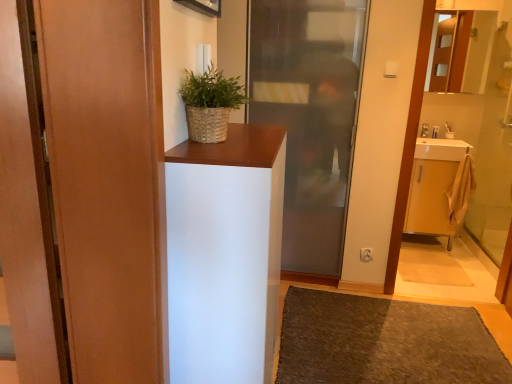
Describe the element at coordinates (225, 255) in the screenshot. I see `white matte cabinet at center` at that location.

What are the coordinates of `transparent glass door at center, the first door in the right-to-left sequence` in the screenshot? It's located at (309, 115).

What do you see at coordinates (309, 115) in the screenshot? I see `transparent glass door at center, placed as the 2th door when sorted from left to right` at bounding box center [309, 115].

The image size is (512, 384). I want to click on brown textured rug at lower center, so click(x=384, y=342).

Image resolution: width=512 pixels, height=384 pixels. What do you see at coordinates (108, 182) in the screenshot? I see `matte wood door at left, the 1th door from the front` at bounding box center [108, 182].

The width and height of the screenshot is (512, 384). I want to click on white matte cabinet at center, so click(225, 255).

Which point is more forward, (354, 362) or (425, 135)?

Point (354, 362)

Who is taller, brown textured rug at lower center or white plastic toothbrush at upper right?

With more height is white plastic toothbrush at upper right.

Is brown textured rug at lower center facing away from white plastic toothbrush at upper right?

No, brown textured rug at lower center's orientation is not away from white plastic toothbrush at upper right.

Which object is positioned more to the left, woven brown basket at upper center or matte wood door at left, the 1th door from the front?

From the viewer's perspective, matte wood door at left, the 1th door from the front, appears more on the left side.

Looking at this image, is woven brown basket at upper center oriented towards matte wood door at left, marked as the first door in a left-to-right arrangement?

No, woven brown basket at upper center is not facing towards matte wood door at left, marked as the first door in a left-to-right arrangement.

From the image's perspective, relative to matte wood door at left, arranged as the 2th door when viewed from the back, is woven brown basket at upper center above or below?

Clearly, from the image's perspective, woven brown basket at upper center is above matte wood door at left, arranged as the 2th door when viewed from the back.

Does woven brown basket at upper center have a greater width compared to matte wood door at left, the 2th door from the right?

In fact, woven brown basket at upper center might be narrower than matte wood door at left, the 2th door from the right.

Consider the image. From a real-world perspective, who is located higher, matte wood door at left, marked as the first door in a left-to-right arrangement, or white plastic toothbrush at upper right?

matte wood door at left, marked as the first door in a left-to-right arrangement, is physically above.

Who is shorter, matte wood door at left, arranged as the 2th door when viewed from the back, or white plastic toothbrush at upper right?

With less height is white plastic toothbrush at upper right.

Is matte wood door at left, marked as the first door in a left-to-right arrangement, to the left of white plastic toothbrush at upper right from the viewer's perspective?

Yes, matte wood door at left, marked as the first door in a left-to-right arrangement, is to the left of white plastic toothbrush at upper right.

Find the location of a particular element. The image size is (512, 384). houseplant in front of the transparent glass door at center, the first door in the right-to-left sequence is located at coordinates (210, 104).

Is woven brown basket at upper center at the left side of transparent glass door at center, which is counted as the 2th door, starting from the front?

Indeed, woven brown basket at upper center is positioned on the left side of transparent glass door at center, which is counted as the 2th door, starting from the front.

Which is further, (206, 86) or (335, 274)?

The point (335, 274) is farther from the camera.

Is white matte cabinet at center further to the viewer compared to transparent glass door at center, which is counted as the 2th door, starting from the front?

No.

From the image's perspective, which one is positioned higher, white matte cabinet at center or transparent glass door at center, placed as the 2th door when sorted from left to right?

From the image's view, transparent glass door at center, placed as the 2th door when sorted from left to right, is above.

Considering the sizes of white matte cabinet at center and transparent glass door at center, the first door in the right-to-left sequence, in the image, is white matte cabinet at center taller or shorter than transparent glass door at center, the first door in the right-to-left sequence,?

Clearly, white matte cabinet at center is shorter compared to transparent glass door at center, the first door in the right-to-left sequence.

Is white plastic toothbrush at upper right positioned far away from white matte cabinet at center?

white plastic toothbrush at upper right is positioned a significant distance from white matte cabinet at center.

In the scene shown: Does white plastic toothbrush at upper right turn towards white matte cabinet at center?

No, white plastic toothbrush at upper right does not turn towards white matte cabinet at center.

The image size is (512, 384). I want to click on cabinetry that is below the white plastic toothbrush at upper right (from the image's perspective), so click(225, 255).

Looking at this image, based on their sizes in the image, would you say white plastic toothbrush at upper right is bigger or smaller than white matte cabinet at center?

white plastic toothbrush at upper right is smaller than white matte cabinet at center.

Does woven brown basket at upper center come in front of white plastic toothbrush at upper right?

Yes, the depth of woven brown basket at upper center is less than that of white plastic toothbrush at upper right.

Would you say woven brown basket at upper center is a long distance from white plastic toothbrush at upper right?

woven brown basket at upper center is positioned a significant distance from white plastic toothbrush at upper right.

Locate an element on the screen. This screenshot has width=512, height=384. houseplant in front of the white plastic toothbrush at upper right is located at coordinates (210, 104).

The image size is (512, 384). I want to click on toiletry to the right of brown textured rug at lower center, so click(424, 130).

Locate an element on the screen. This screenshot has width=512, height=384. houseplant behind the matte wood door at left, the 2th door from the right is located at coordinates (210, 104).

Which object lies further to the anchor point matte wood door at left, the 2th door from the right, white matte cabinet at center or transparent glass door at center, the first door in the right-to-left sequence?

transparent glass door at center, the first door in the right-to-left sequence, is positioned further to the anchor matte wood door at left, the 2th door from the right.

Based on their spatial positions, is white plastic toothbrush at upper right or brown textured rug at lower center further from white matte cabinet at center?

The object further to white matte cabinet at center is white plastic toothbrush at upper right.

From the image, which object appears to be nearer to matte wood door at left, the 1th door from the front, brown textured rug at lower center or white matte cabinet at center?

Among the two, white matte cabinet at center is located nearer to matte wood door at left, the 1th door from the front.

Which object lies nearer to the anchor point transparent glass door at center, which is the 1th door in back-to-front order, matte wood door at left, the 2th door from the right, or brown textured rug at lower center?

Among the two, brown textured rug at lower center is located nearer to transparent glass door at center, which is the 1th door in back-to-front order.

Considering their positions, is white matte cabinet at center positioned closer to white plastic toothbrush at upper right than brown textured rug at lower center?

Based on the image, brown textured rug at lower center appears to be nearer to white plastic toothbrush at upper right.

When comparing their distances from transparent glass door at center, the first door in the right-to-left sequence, does woven brown basket at upper center or brown textured rug at lower center seem further?

woven brown basket at upper center lies further to transparent glass door at center, the first door in the right-to-left sequence, than the other object.

In the scene shown: Estimate the real-world distances between objects in this image. Which object is further from white plastic toothbrush at upper right, brown textured rug at lower center or transparent glass door at center, placed as the 2th door when sorted from left to right?

brown textured rug at lower center.

From the picture: Looking at the image, which one is located further to transparent glass door at center, placed as the 2th door when sorted from left to right, matte wood door at left, arranged as the 2th door when viewed from the back, or white plastic toothbrush at upper right?

matte wood door at left, arranged as the 2th door when viewed from the back, is further to transparent glass door at center, placed as the 2th door when sorted from left to right.

I want to click on houseplant positioned between white matte cabinet at center and transparent glass door at center, which is the 1th door in back-to-front order, from near to far, so click(x=210, y=104).

The width and height of the screenshot is (512, 384). Identify the location of cabinetry between woven brown basket at upper center and brown textured rug at lower center in the vertical direction. (225, 255).

The height and width of the screenshot is (384, 512). I want to click on door between white matte cabinet at center and white plastic toothbrush at upper right along the z-axis, so click(309, 115).

At what (x,y) coordinates should I click in order to perform the action: click on cabinetry between matte wood door at left, the 1th door from the front, and white plastic toothbrush at upper right, along the z-axis. Please return your answer as a coordinate pair (x, y). Looking at the image, I should click on (225, 255).